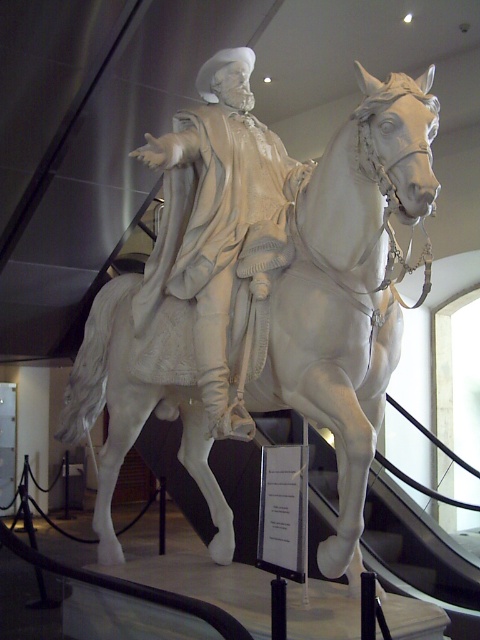
Does white marble horse at center have a greater width compared to white marble statue at center?

Yes, white marble horse at center is wider than white marble statue at center.

Which is behind, point (335, 195) or point (181, 262)?

Point (181, 262)

Looking at this image, who is more forward, (254,196) or (190,296)?

Positioned in front is point (190,296).

Locate an element on the screen. The image size is (480, 640). white marble horse at center is located at coordinates (338, 285).